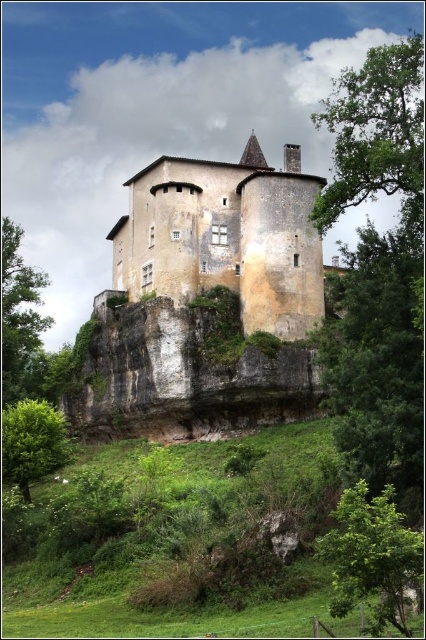
What do you see at coordinates (226, 237) in the screenshot? This screenshot has height=640, width=426. I see `yellowish stone castle at center` at bounding box center [226, 237].

From the picture: Does yellowish stone castle at center have a greater width compared to green leafy tree at lower left?

Yes, yellowish stone castle at center is wider than green leafy tree at lower left.

Between point (264, 214) and point (36, 417), which one is positioned behind?

Point (264, 214)

Locate an element on the screen. The width and height of the screenshot is (426, 640). yellowish stone castle at center is located at coordinates (226, 237).

Is point (402, 266) in front of point (412, 80)?

Yes.

Does green leafy tree at center appear over green leafy tree at upper right?

Actually, green leafy tree at center is below green leafy tree at upper right.

Is point (406, 403) positioned in front of point (374, 102)?

Yes, point (406, 403) is closer to viewer.

Where is `green leafy tree at center`? This screenshot has height=640, width=426. green leafy tree at center is located at coordinates (377, 358).

Which is below, yellowish stone castle at center or green leafy tree at upper right?

yellowish stone castle at center

Consider the image. Does yellowish stone castle at center appear under green leafy tree at upper right?

Yes, yellowish stone castle at center is below green leafy tree at upper right.

This screenshot has height=640, width=426. I want to click on yellowish stone castle at center, so click(226, 237).

Locate an element on the screen. This screenshot has width=426, height=640. yellowish stone castle at center is located at coordinates (226, 237).